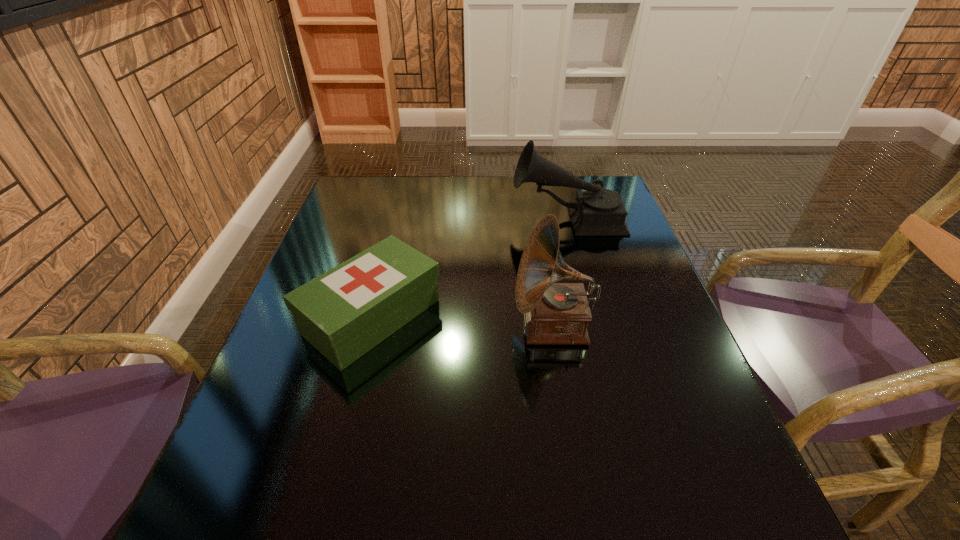
Image resolution: width=960 pixels, height=540 pixels. In order to click on vacant region located 0.090m from the horn of the second shortest object in this screenshot , I will do `click(481, 218)`.

At what (x,y) coordinates should I click in order to perform the action: click on vacant area located on the back of the first-aid kit. Please return your answer as a coordinate pair (x, y). The image size is (960, 540). Looking at the image, I should click on (404, 190).

At what (x,y) coordinates should I click in order to perform the action: click on object located at the far edge. Please return your answer as a coordinate pair (x, y). This screenshot has height=540, width=960. Looking at the image, I should click on (597, 211).

Identify the location of object that is positioned at the left edge. The image size is (960, 540). (345, 312).

This screenshot has width=960, height=540. In order to click on object that is at the right edge in this screenshot , I will do `click(597, 211)`.

The width and height of the screenshot is (960, 540). I want to click on object situated at the far right corner, so click(597, 211).

The height and width of the screenshot is (540, 960). I want to click on vacant area at the far edge, so click(x=475, y=194).

The image size is (960, 540). In the image, there is a desktop. Find the location of `vacant space at the right edge`. vacant space at the right edge is located at coordinates tap(694, 490).

Identify the location of free space at the near left corner of the desktop. (211, 495).

Find the location of a particular element. Image resolution: width=960 pixels, height=540 pixels. free area in between the nearer phonograph_record and the leftmost object is located at coordinates (463, 321).